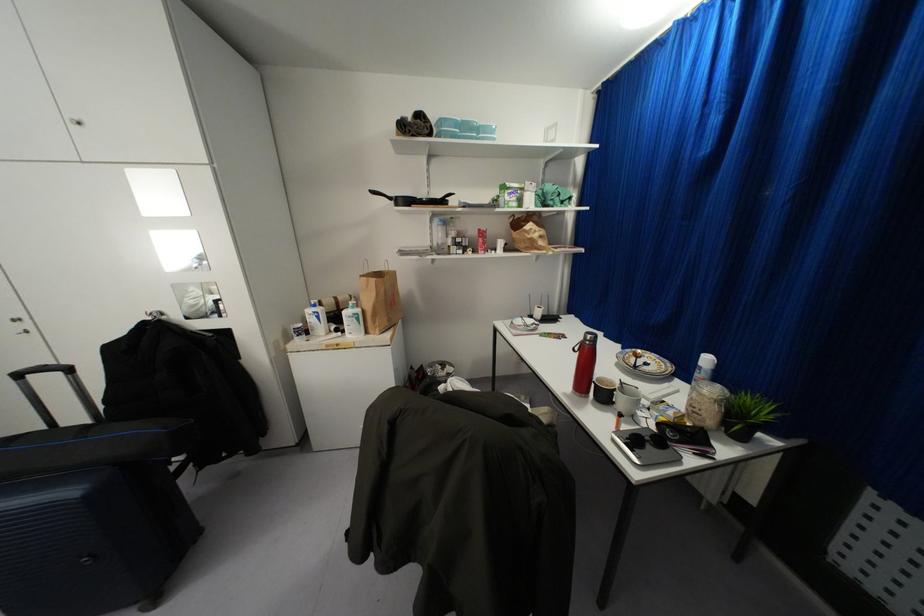
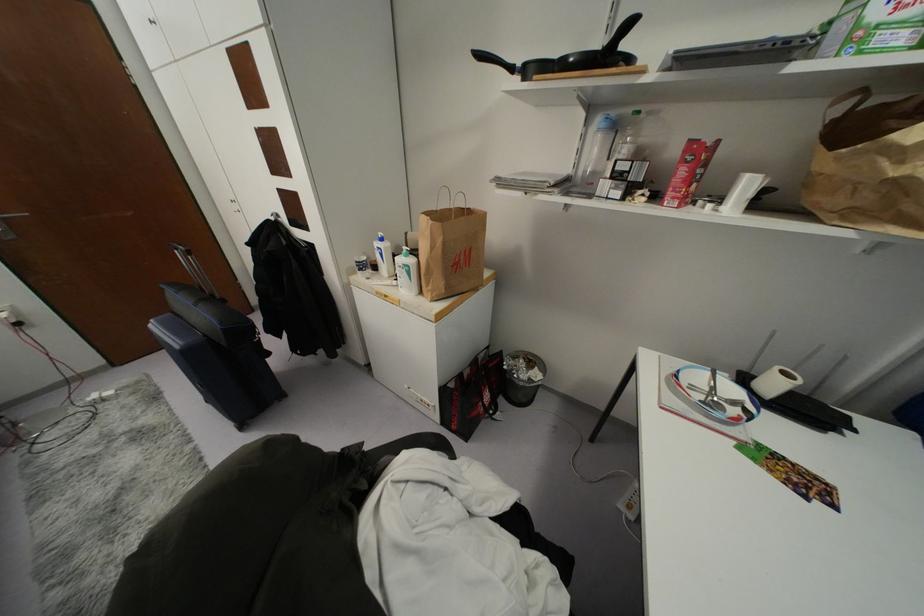
The images are taken continuously from a first-person perspective. In which direction is your viewpoint rotating?

The rotation direction of the camera is left-down.